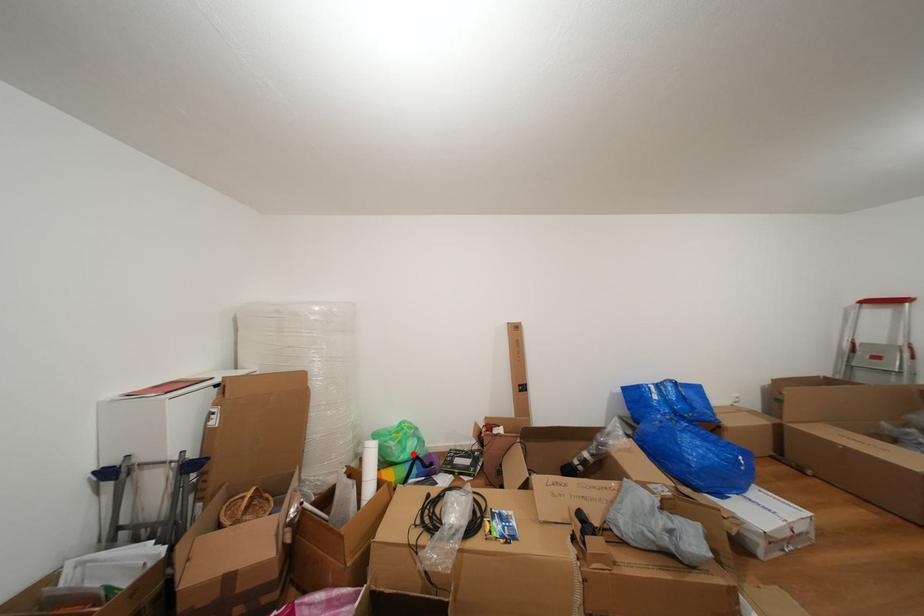
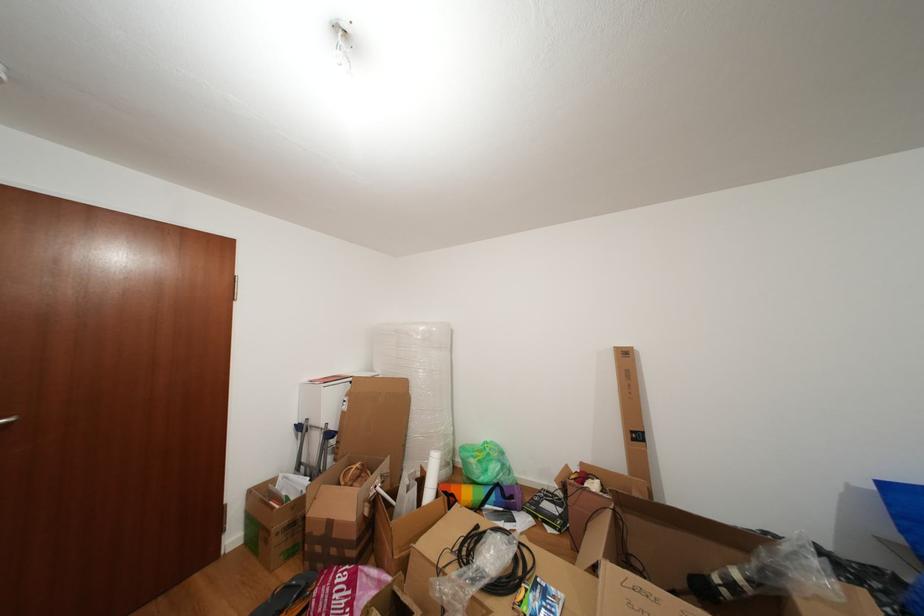
Where in the second image is the point corresponding to the highlighted location from the first image?

(494, 476)